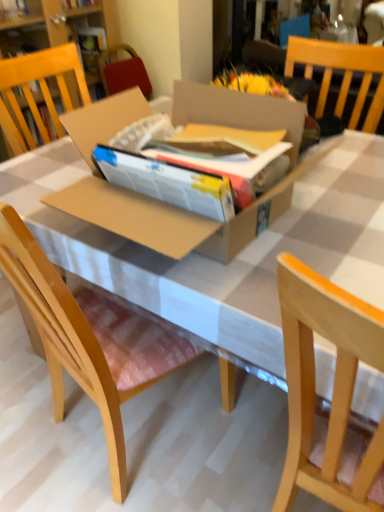
Question: Would you consider wooden chair at center, which ranks as the first chair in left-to-right order, to be distant from light wood chair at right, the 2th chair from the left?

Choices:
 (A) no
 (B) yes

Answer: (A)

Question: Is wooden chair at center, which is the 2th chair in right-to-left order, beside light wood chair at right, acting as the 1th chair starting from the right?

Choices:
 (A) no
 (B) yes

Answer: (A)

Question: Is wooden chair at center, which ranks as the first chair in left-to-right order, oriented towards light wood chair at right, acting as the 1th chair starting from the right?

Choices:
 (A) no
 (B) yes

Answer: (A)

Question: Does wooden chair at center, which is the 2th chair in right-to-left order, come behind light wood chair at right, acting as the 1th chair starting from the right?

Choices:
 (A) yes
 (B) no

Answer: (A)

Question: Is wooden chair at center, which is the 2th chair in right-to-left order, turned away from light wood chair at right, the 2th chair from the left?

Choices:
 (A) no
 (B) yes

Answer: (A)

Question: Based on their sizes in the image, would you say brown cardboard box at center is bigger or smaller than wooden chair at center, which ranks as the first chair in left-to-right order?

Choices:
 (A) big
 (B) small

Answer: (A)

Question: In the image, is brown cardboard box at center on the left side or the right side of wooden chair at center, which is the 2th chair in right-to-left order?

Choices:
 (A) left
 (B) right

Answer: (B)

Question: From their relative heights in the image, would you say brown cardboard box at center is taller or shorter than wooden chair at center, which is the 2th chair in right-to-left order?

Choices:
 (A) short
 (B) tall

Answer: (A)

Question: Is brown cardboard box at center in front of or behind wooden chair at center, which ranks as the first chair in left-to-right order, in the image?

Choices:
 (A) front
 (B) behind

Answer: (B)

Question: Is point (322, 332) closer or farther from the camera than point (175, 239)?

Choices:
 (A) farther
 (B) closer

Answer: (B)

Question: Is light wood chair at right, acting as the 1th chair starting from the right, situated inside brown cardboard box at center or outside?

Choices:
 (A) inside
 (B) outside

Answer: (B)

Question: Is light wood chair at right, the 2th chair from the left, bigger or smaller than brown cardboard box at center?

Choices:
 (A) small
 (B) big

Answer: (B)

Question: Considering the positions of light wood chair at right, the 2th chair from the left, and brown cardboard box at center in the image, is light wood chair at right, the 2th chair from the left, wider or thinner than brown cardboard box at center?

Choices:
 (A) thin
 (B) wide

Answer: (A)

Question: In the image, is light wood chair at right, acting as the 1th chair starting from the right, on the left side or the right side of wooden chair at center, which is the 2th chair in right-to-left order?

Choices:
 (A) right
 (B) left

Answer: (A)

Question: Is light wood chair at right, the 2th chair from the left, wider or thinner than wooden chair at center, which is the 2th chair in right-to-left order?

Choices:
 (A) thin
 (B) wide

Answer: (B)